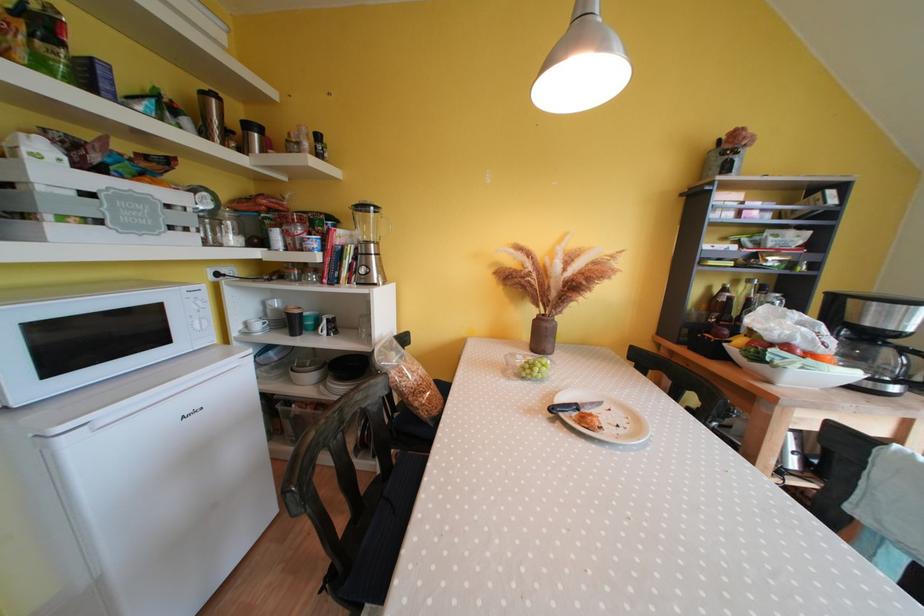
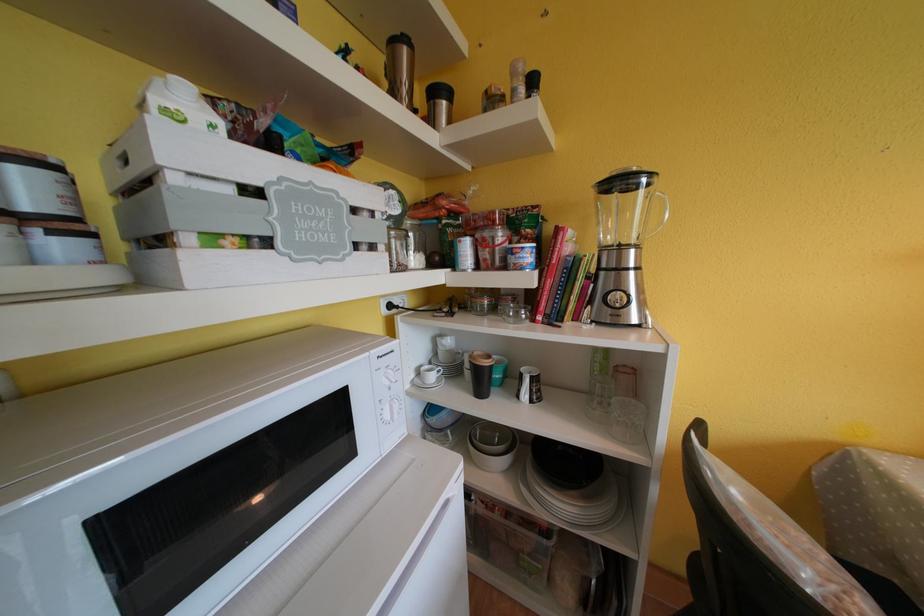
Locate, in the second image, the point that corresponds to pixel 224 278 in the first image.

(396, 310)